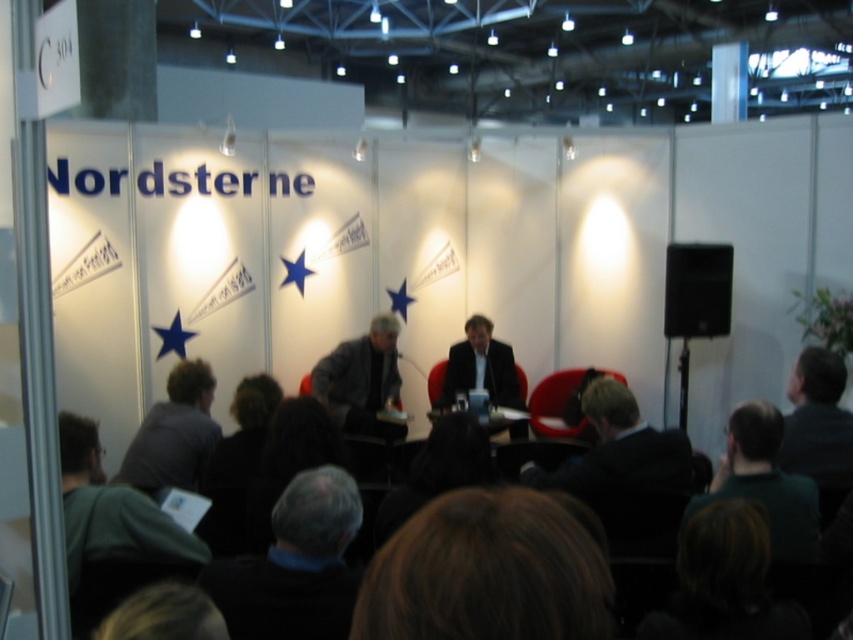
You are an event organizer setting up a photo shoot for the conference. You need to ensure that the brown hair at center and the dark gray shirt at lower left are both visible in the frame. Based on their sizes, which object should you prioritize positioning closer to the camera to maintain clarity?

The brown hair at center has a smaller width than the dark gray shirt at lower left, so you should prioritize positioning the brown hair at center closer to the camera to ensure it remains visible and clear in the photo shoot.

You are a photographer setting up for a group photo. You need to position two speakers wearing the dark gray suit at lower right and the gray fabric jacket at center so that their clothing details are clearly visible. Considering their clothing thickness, which speaker should be placed closer to the spotlight to avoid shadows obscuring the details?

The dark gray suit at lower right is thinner than the gray fabric jacket at center, so the speaker in the dark gray suit at lower right should be placed closer to the spotlight. Thinner fabrics reflect light better and require less intense lighting to show details clearly, whereas thicker fabrics like the gray fabric jacket at center may cast deeper shadows if too close to the light source.